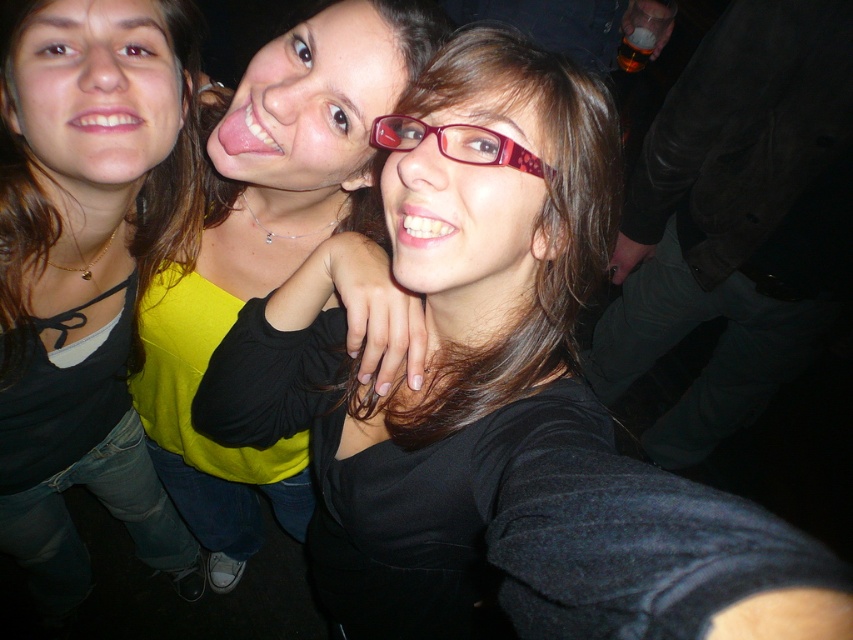
You are at a party and want to describe the clothing of the person in the middle. Which item is positioned lower on their body between the yellow matte sweater at center and the matte red glasses at center?

The yellow matte sweater at center is located below the matte red glasses at center, so the sweater is positioned lower on their body.

You are a photographer at a party and want to capture a photo of the yellow matte sweater at center and the matte red glasses at center. Which object should you focus on first if you want to include both in the frame without moving the camera?

You should focus on the yellow matte sweater at center first because it is positioned on the left side of the matte red glasses at center, so by centering the camera on the leftmost object, both can be included in the frame.

You are standing at the center of the image and want to move towards the point at the bottom right corner. Which point, point at (490, 32) or point at (349, 124), is closer to your current position?

Point at (349, 124) is closer to the center of the image than point at (490, 32) because it has a lower y coordinate, meaning it is positioned lower on the screen. Since you are moving towards the bottom right corner, point at (349, 124) is closer to your starting position.